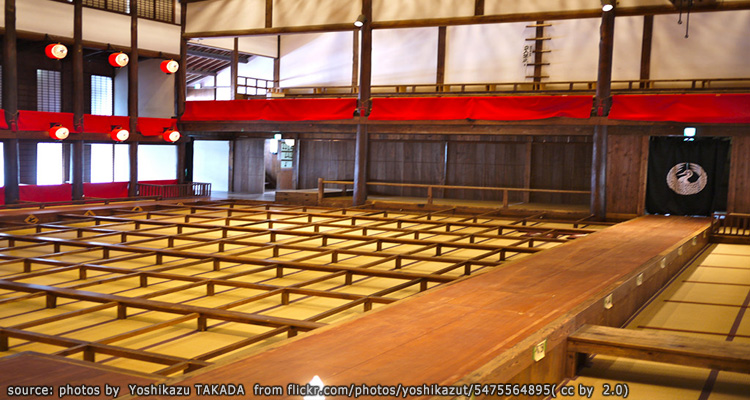
Image resolution: width=750 pixels, height=400 pixels. I want to click on stickers, so click(537, 352).